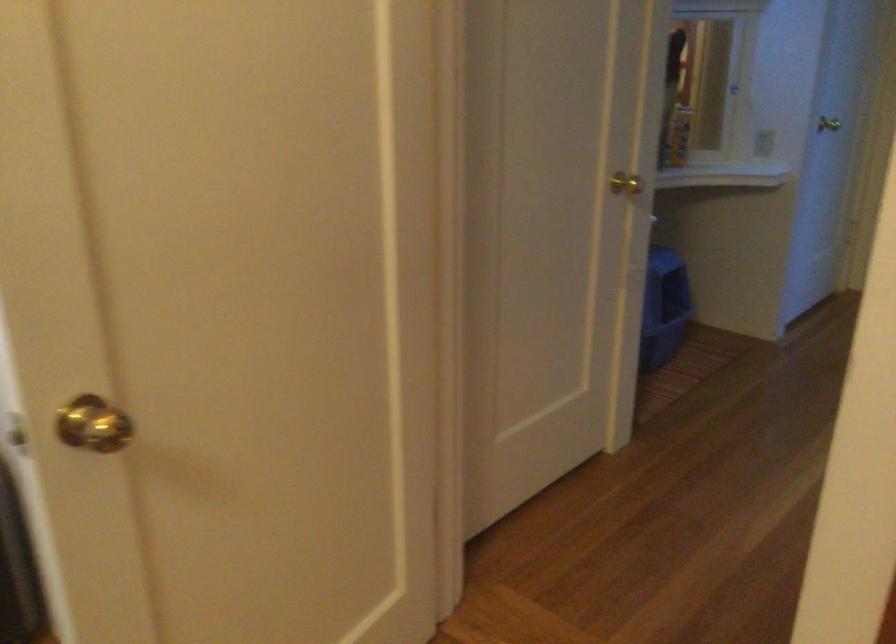
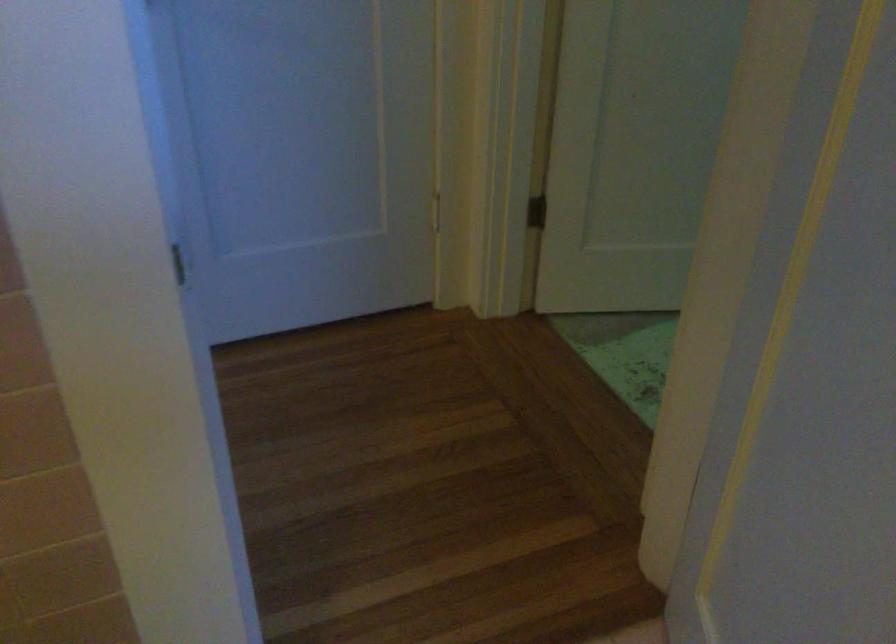
In a continuous first-person perspective shot, in which direction is the camera moving?

The cameraman walked toward right, forward.